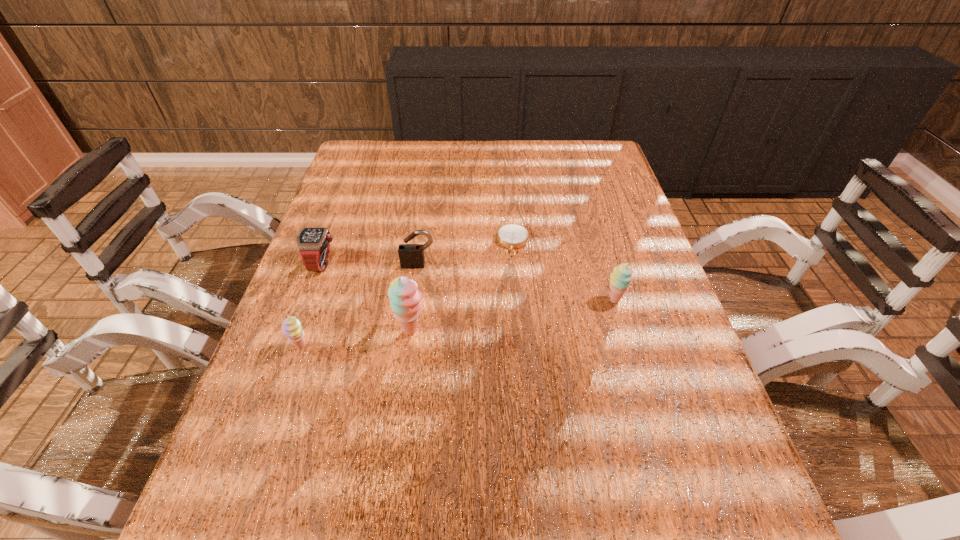
Where is `vacant space located on the right of the second sherbert from right to left`? vacant space located on the right of the second sherbert from right to left is located at coordinates (459, 330).

This screenshot has width=960, height=540. I want to click on free space located on the right of the farthest sherbert, so click(671, 300).

Locate an element on the screen. vacant space located 0.350m on the front of the watch is located at coordinates [270, 407].

Locate an element on the screen. This screenshot has height=540, width=960. free space located with the keyhole on the front of the padlock is located at coordinates (410, 324).

This screenshot has height=540, width=960. Identify the location of vacant space located on the front of the compass. (517, 299).

Where is `sherbert that is at the left edge`? The width and height of the screenshot is (960, 540). sherbert that is at the left edge is located at coordinates (291, 327).

Image resolution: width=960 pixels, height=540 pixels. I want to click on watch located in the left edge section of the desktop, so click(x=313, y=244).

Locate an element on the screen. This screenshot has height=540, width=960. object located in the right edge section of the desktop is located at coordinates (620, 279).

Where is `free region at the far edge`? The width and height of the screenshot is (960, 540). free region at the far edge is located at coordinates (462, 171).

In order to click on free location at the near edge in this screenshot , I will do pos(582,462).